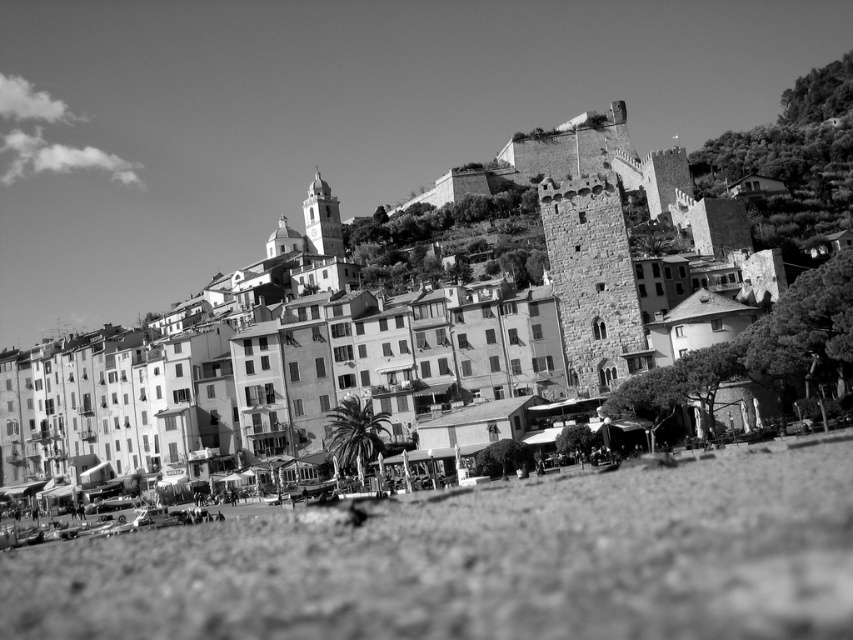
Is rough stone tower at center above smooth stone tower at upper center?

Actually, rough stone tower at center is below smooth stone tower at upper center.

Identify the location of rough stone tower at center. The image size is (853, 640). (593, 282).

Is the position of gravelly sand at lower center less distant than that of smooth stone tower at upper center?

That is True.

This screenshot has height=640, width=853. Describe the element at coordinates (480, 563) in the screenshot. I see `gravelly sand at lower center` at that location.

The height and width of the screenshot is (640, 853). In order to click on gravelly sand at lower center in this screenshot , I will do `click(480, 563)`.

Does gravelly sand at lower center have a greater width compared to rough stone tower at center?

Yes, gravelly sand at lower center is wider than rough stone tower at center.

What do you see at coordinates (480, 563) in the screenshot?
I see `gravelly sand at lower center` at bounding box center [480, 563].

Measure the distance between point (321, 529) and camera.

The distance of point (321, 529) from camera is 169.12 feet.

Locate an element on the screen. gravelly sand at lower center is located at coordinates (480, 563).